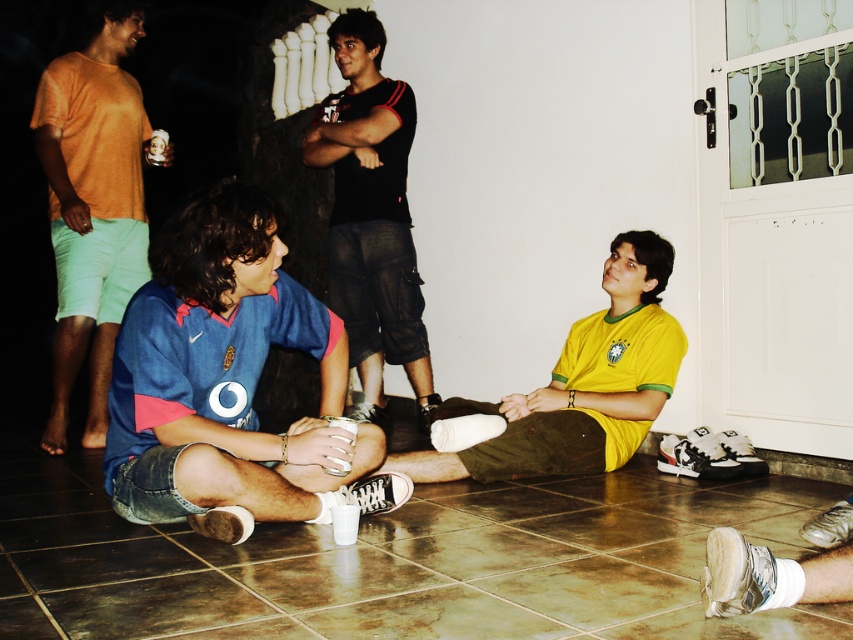
Who is more forward, (332, 358) or (358, 355)?

Positioned in front is point (332, 358).

At what (x,y) coordinates should I click in order to perform the action: click on blue denim shorts at center. Please return your answer as a coordinate pair (x, y). Looking at the image, I should click on (228, 384).

Between point (351, 308) and point (653, 301), which one is positioned in front?

Point (653, 301) is in front.

Is black cotton shirt at center below yellow jersey at center?

Incorrect, black cotton shirt at center is not positioned below yellow jersey at center.

Describe the element at coordinates (370, 216) in the screenshot. I see `black cotton shirt at center` at that location.

Locate an element on the screen. This screenshot has height=640, width=853. black cotton shirt at center is located at coordinates (370, 216).

Is matte orange t-shirt at left wider than black cotton shirt at center?

No.

Locate an element on the screen. The image size is (853, 640). matte orange t-shirt at left is located at coordinates (91, 205).